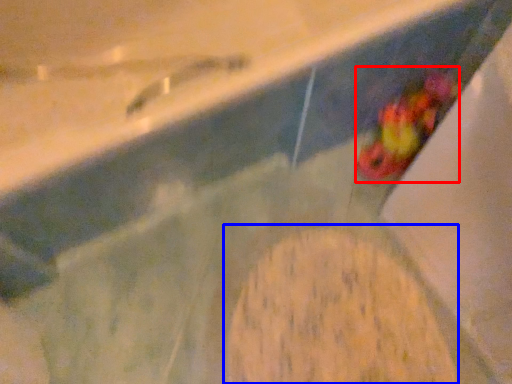
Question: Which of the following is the closest to the observer, food (highlighted by a red box) or food (highlighted by a blue box)?

Choices:
 (A) food
 (B) food

Answer: (B)